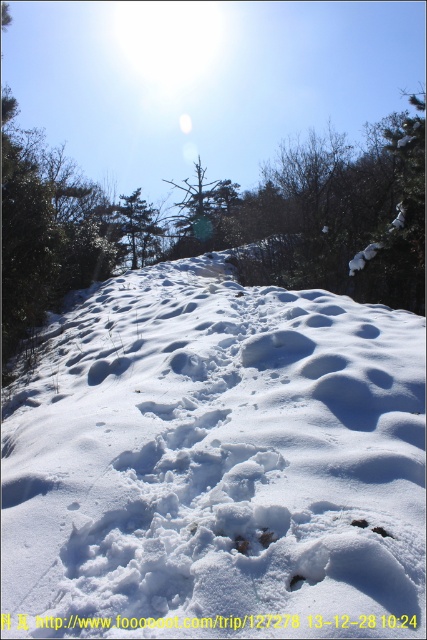
Question: Is white fluffy snow at center closer to camera compared to green matte tree at upper center?

Choices:
 (A) yes
 (B) no

Answer: (A)

Question: Which object is positioned farthest from the green matte tree at upper center?

Choices:
 (A) green matte tree at center
 (B) white fluffy snow at center

Answer: (B)

Question: Observing the image, what is the correct spatial positioning of green matte tree at center in reference to green matte tree at upper center?

Choices:
 (A) above
 (B) below

Answer: (A)

Question: Does white fluffy snow at center have a smaller size compared to green matte tree at upper center?

Choices:
 (A) yes
 (B) no

Answer: (A)

Question: Among these objects, which one is farthest from the camera?

Choices:
 (A) green matte tree at upper center
 (B) white fluffy snow at center
 (C) green matte tree at center

Answer: (A)

Question: Which point is farther to the camera?

Choices:
 (A) (170, 220)
 (B) (136, 243)

Answer: (A)